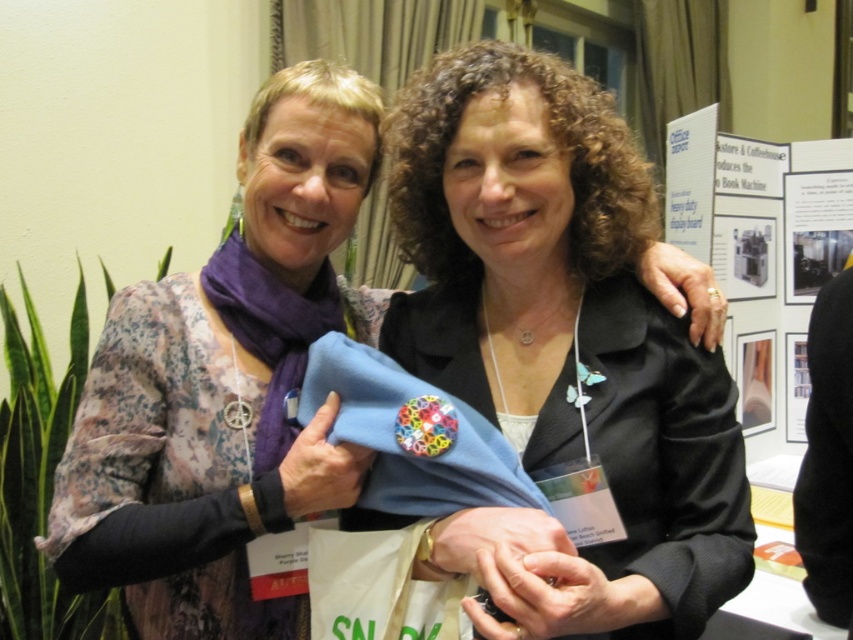
Question: Does black matte blazer at center appear on the right side of blue fabric at center?

Choices:
 (A) no
 (B) yes

Answer: (B)

Question: Does black matte blazer at center have a lesser width compared to blue fabric at center?

Choices:
 (A) yes
 (B) no

Answer: (B)

Question: Which object is closer to the camera taking this photo?

Choices:
 (A) blue fabric at center
 (B) black matte blazer at center

Answer: (B)

Question: Which point is farther from the camera taking this photo?

Choices:
 (A) (192, 372)
 (B) (489, 188)

Answer: (A)

Question: Can you confirm if black matte blazer at center is positioned below blue fabric at center?

Choices:
 (A) yes
 (B) no

Answer: (B)

Question: Which object is closer to the camera taking this photo?

Choices:
 (A) black matte blazer at center
 (B) blue fabric at center

Answer: (A)